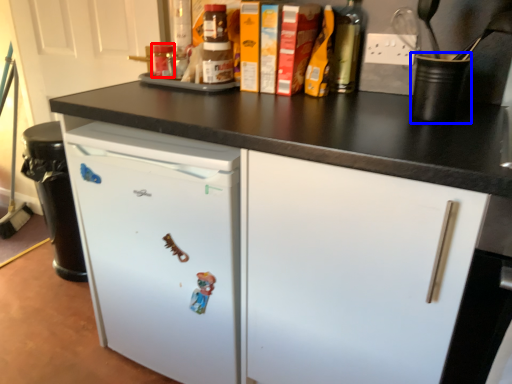
Question: Which object appears farthest to the camera in this image, bottle (highlighted by a red box) or appliance (highlighted by a blue box)?

Choices:
 (A) bottle
 (B) appliance

Answer: (A)